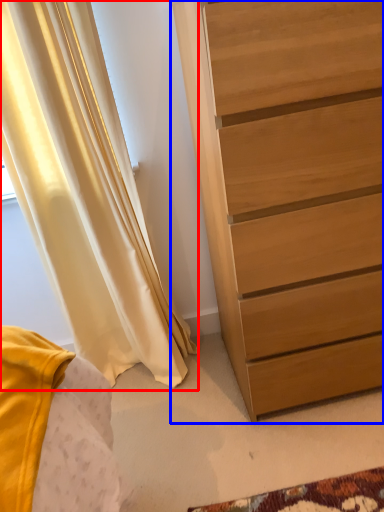
Question: Which object is further to the camera taking this photo, curtain (highlighted by a red box) or chest of drawers (highlighted by a blue box)?

Choices:
 (A) curtain
 (B) chest of drawers

Answer: (A)